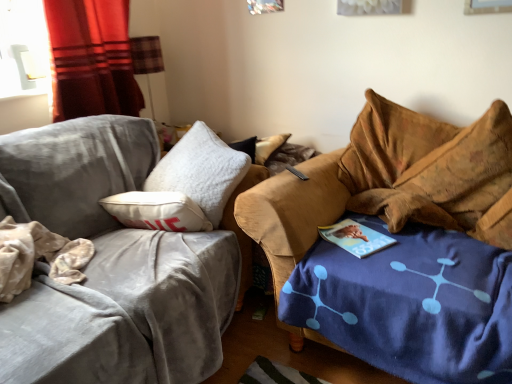
Question: Considering the positions of point (426, 173) and point (132, 59), is point (426, 173) closer or farther from the camera than point (132, 59)?

Choices:
 (A) closer
 (B) farther

Answer: (A)

Question: In the image, is brown velvety bean bag chair at right positioned in front of or behind plaid fabric lampshade at upper left?

Choices:
 (A) front
 (B) behind

Answer: (A)

Question: Which object is the closest to the velvet gray couch at left, which is the second studio couch in right-to-left order?

Choices:
 (A) plaid fabric lampshade at upper left
 (B) brown velvety bean bag chair at right
 (C) velvet brown couch at right, the first studio couch in the right-to-left sequence
 (D) red fabric curtain at left

Answer: (D)

Question: Considering the real-world distances, which object is closest to the velvet gray couch at left, the 1th studio couch when ordered from left to right?

Choices:
 (A) red fabric curtain at left
 (B) velvet brown couch at right, which is counted as the 2th studio couch, starting from the left
 (C) brown velvety bean bag chair at right
 (D) plaid fabric lampshade at upper left

Answer: (A)